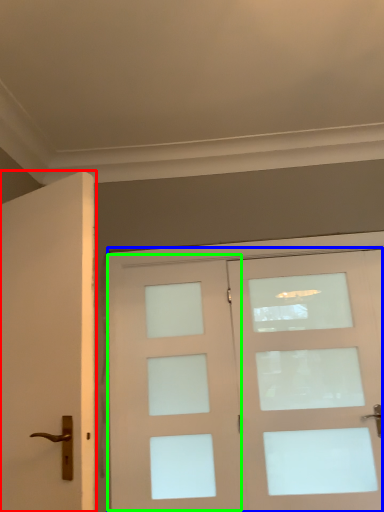
Question: Estimate the real-world distances between objects in this image. Which object is closer to door (highlighted by a red box), door (highlighted by a blue box) or screen door (highlighted by a green box)?

Choices:
 (A) door
 (B) screen door

Answer: (B)